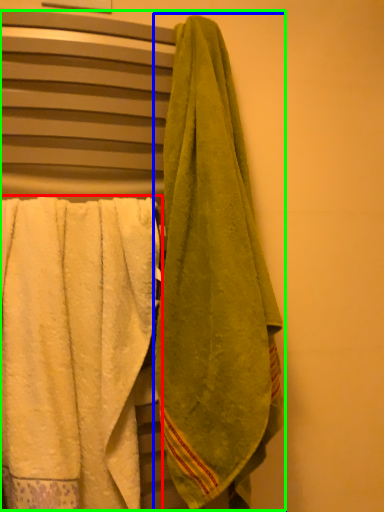
Question: Which is nearer to the towel (highlighted by a red box)? towel (highlighted by a blue box) or laundry (highlighted by a green box).

Choices:
 (A) towel
 (B) laundry

Answer: (B)